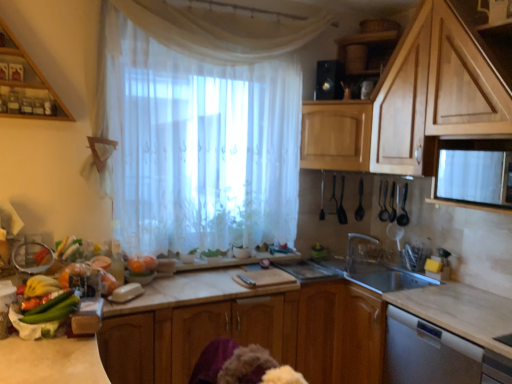
Where is `free spot above wooden cabinet at center, which is counted as the 4th cabinetry, starting from the top (from a real-world perspective)`? free spot above wooden cabinet at center, which is counted as the 4th cabinetry, starting from the top (from a real-world perspective) is located at coordinates (220, 279).